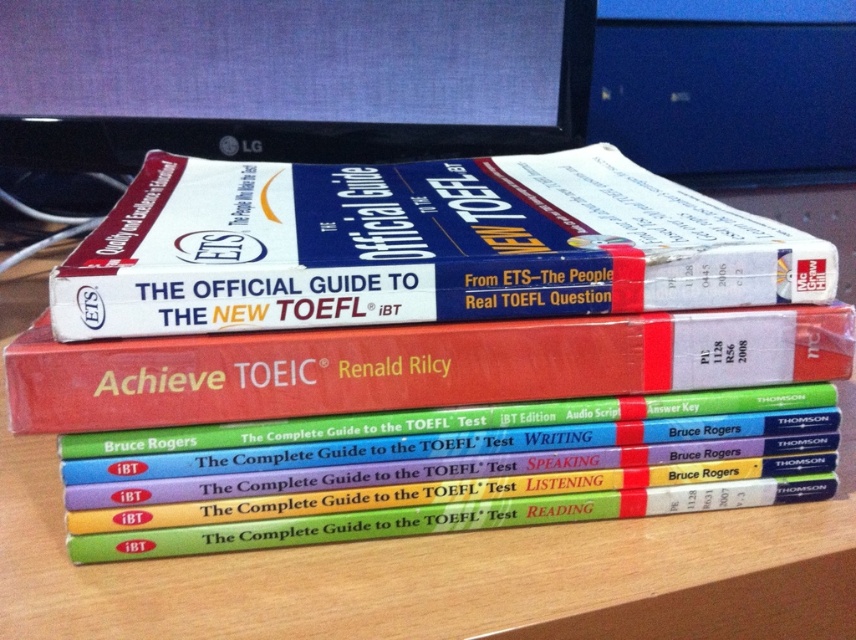
Is white paper at upper center wider than black glossy monitor at upper center?

No, white paper at upper center is not wider than black glossy monitor at upper center.

Does point (87, 269) come closer to viewer compared to point (170, 145)?

Yes, point (87, 269) is in front of point (170, 145).

Where is `white paper at upper center`? This screenshot has height=640, width=856. white paper at upper center is located at coordinates (418, 246).

Is white paper at upper center thinner than red matte hardcover book at center?

No.

Measure the distance between white paper at upper center and camera.

white paper at upper center and camera are 19.88 inches apart from each other.

I want to click on white paper at upper center, so tap(418, 246).

What are the coordinates of `white paper at upper center` in the screenshot? It's located at (418, 246).

You are a GUI agent. You are given a task and a screenshot of the screen. Output one action in this format:
    pyautogui.click(x=<x>, y=<y>)
    Task: Click on the black glossy monitor at upper center
    
    Given the screenshot: What is the action you would take?
    pyautogui.click(x=289, y=77)

Is point (480, 97) positioned in front of point (296, 336)?

No, it is behind (296, 336).

Image resolution: width=856 pixels, height=640 pixels. What do you see at coordinates (289, 77) in the screenshot?
I see `black glossy monitor at upper center` at bounding box center [289, 77].

Find the location of `black glossy monitor at upper center`. black glossy monitor at upper center is located at coordinates (289, 77).